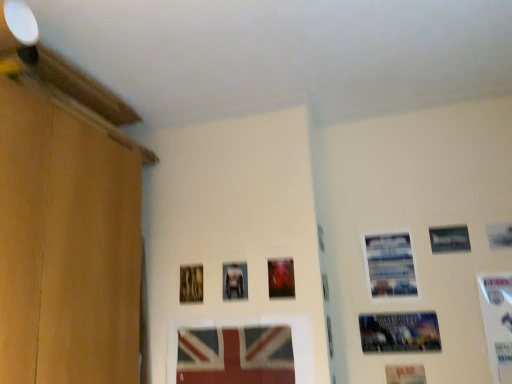
Question: Would you say matte plastic picture frame at center, which is the 2th picture frame in left-to-right order, is to the left or to the right of metallic poster at lower right, which is the sixth picture frame from left to right, in the picture?

Choices:
 (A) left
 (B) right

Answer: (A)

Question: From the image's perspective, is matte plastic picture frame at center, the 8th picture frame positioned from the right, located above or below metallic poster at lower right, which is the sixth picture frame from left to right?

Choices:
 (A) above
 (B) below

Answer: (B)

Question: Based on their relative distances, which object is farther from the metallic reflective frame at center, the 4th picture frame from the left?

Choices:
 (A) metallic silver picture frame at upper right, the 3th picture frame in the right-to-left sequence
 (B) wooden picture frame at center, positioned as the ninth picture frame in right-to-left order
 (C) metallic silver photo frame at upper right, the fifth picture frame in the right-to-left sequence
 (D) metallic poster at lower right, the fourth picture frame from the right
 (E) white glossy picture frame at right, which is counted as the ninth picture frame, starting from the left

Answer: (E)

Question: Estimate the real-world distances between objects in this image. Which object is closer to the metallic silver picture frame at center, which is counted as the third picture frame, starting from the left?

Choices:
 (A) matte plastic picture frame at center, the 8th picture frame positioned from the right
 (B) metallic silver picture frame at upper right, the 7th picture frame from the left
 (C) wooden picture frame at center, positioned as the ninth picture frame in right-to-left order
 (D) white matte picture frame at upper right, the eighth picture frame positioned from the left
 (E) white glossy picture frame at right, which is counted as the ninth picture frame, starting from the left

Answer: (C)